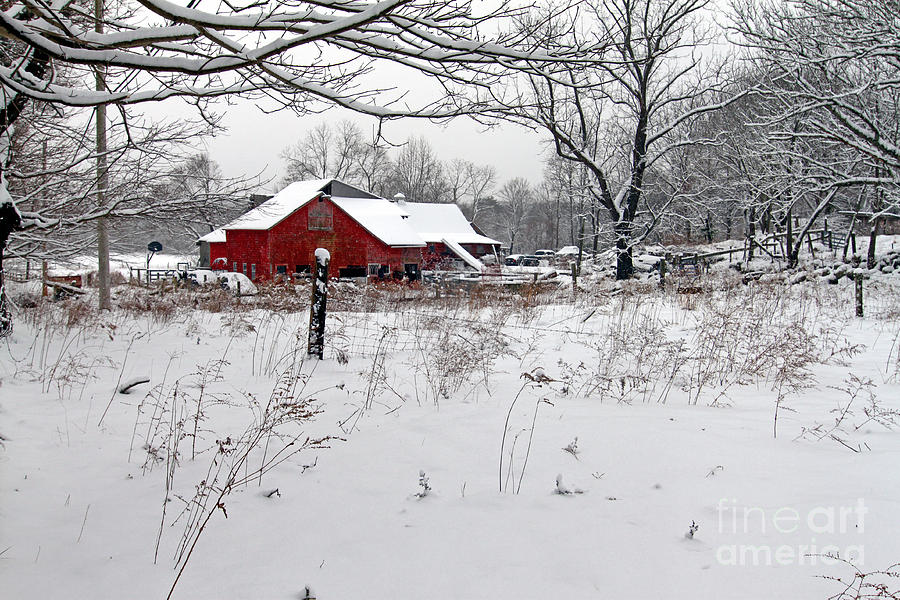
Where is `window`? The image size is (900, 600). window is located at coordinates (x=235, y=267), (x=246, y=265), (x=253, y=268), (x=283, y=269), (x=299, y=269), (x=373, y=271), (x=346, y=272), (x=481, y=249), (x=468, y=249).